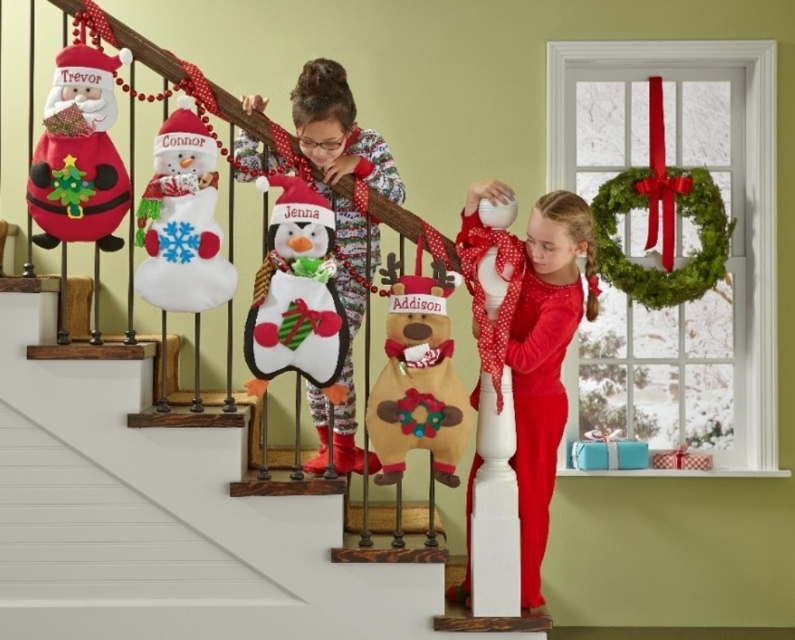
In the scene shown: You are a parent trying to hang a new ornament between the felt penguin at center and the felt snowman at upper left. The ornament requires 12 inches of space. Do you have enough space between them?

The felt penguin at center is 14.28 inches from the felt snowman at upper left, so yes, there is enough space to hang the ornament between them since the required space is 12 inches.

You are a parent trying to hang two felt snowman decorations on the staircase railing. You have the felt snowman at upper left and the felt snowman at upper center. Which one should you hang higher up to ensure they are visible to both the children at the bottom and the adults standing on the staircase?

The felt snowman at upper center should be hung higher because it is larger than the felt snowman at upper left, making it more visible from both lower and higher positions.

You are a photographer standing at the bottom of the staircase. You want to take a photo of the red velvet dress at center and the felt snowman at upper center so that both are clearly visible in the frame. Which object should you focus on first to ensure both are in focus?

You should focus on the red velvet dress at center first because the felt snowman at upper center is behind it, so adjusting focus starting from the closer object will help both be in focus.